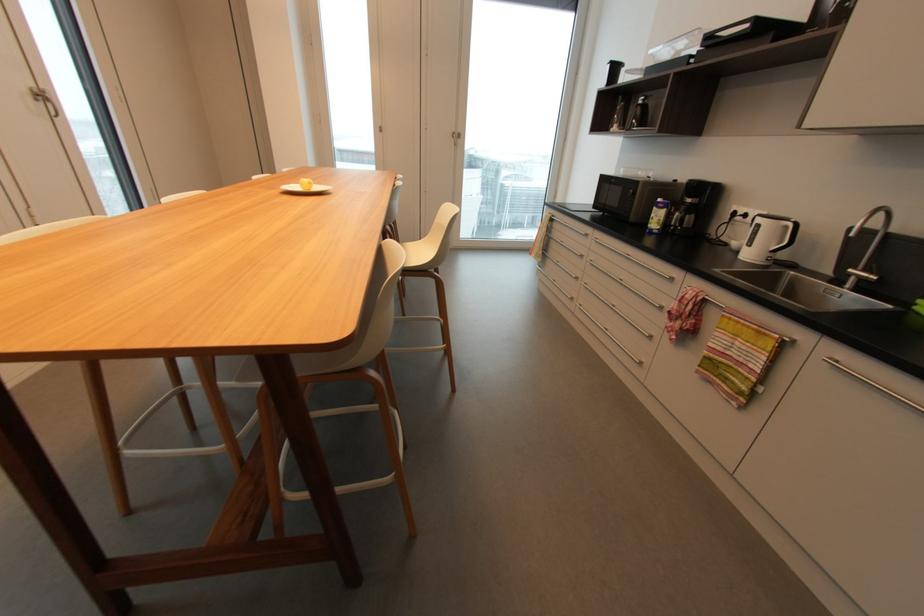
The image size is (924, 616). Describe the element at coordinates (787, 237) in the screenshot. I see `the black microwave handle` at that location.